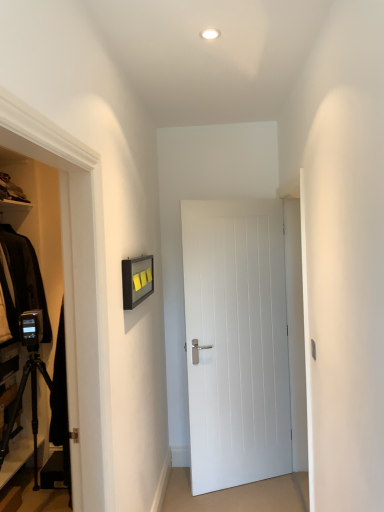
Question: Considering the relative sizes of white glossy light fixture at upper center and black matte tripod at lower left in the image provided, is white glossy light fixture at upper center bigger than black matte tripod at lower left?

Choices:
 (A) yes
 (B) no

Answer: (B)

Question: From a real-world perspective, is white glossy light fixture at upper center located beneath black matte tripod at lower left?

Choices:
 (A) yes
 (B) no

Answer: (B)

Question: Is the depth of white glossy light fixture at upper center greater than that of black matte tripod at lower left?

Choices:
 (A) yes
 (B) no

Answer: (B)

Question: Is white glossy light fixture at upper center aimed at black matte tripod at lower left?

Choices:
 (A) yes
 (B) no

Answer: (B)

Question: Is white glossy light fixture at upper center in contact with black matte tripod at lower left?

Choices:
 (A) no
 (B) yes

Answer: (A)

Question: Considering the relative sizes of white glossy light fixture at upper center and black matte tripod at lower left in the image provided, is white glossy light fixture at upper center smaller than black matte tripod at lower left?

Choices:
 (A) no
 (B) yes

Answer: (B)

Question: From the image's perspective, is white smooth door at center beneath white glossy light fixture at upper center?

Choices:
 (A) no
 (B) yes

Answer: (B)

Question: Considering the relative positions of white smooth door at center and white glossy light fixture at upper center in the image provided, is white smooth door at center to the right of white glossy light fixture at upper center from the viewer's perspective?

Choices:
 (A) no
 (B) yes

Answer: (B)

Question: Is white smooth door at center to the left of white glossy light fixture at upper center from the viewer's perspective?

Choices:
 (A) yes
 (B) no

Answer: (B)

Question: Is white smooth door at center positioned far away from white glossy light fixture at upper center?

Choices:
 (A) no
 (B) yes

Answer: (B)

Question: From a real-world perspective, is white smooth door at center under white glossy light fixture at upper center?

Choices:
 (A) no
 (B) yes

Answer: (B)

Question: Does white smooth door at center turn towards white glossy light fixture at upper center?

Choices:
 (A) no
 (B) yes

Answer: (A)

Question: Is white glossy light fixture at upper center aimed at white smooth door at center?

Choices:
 (A) no
 (B) yes

Answer: (A)